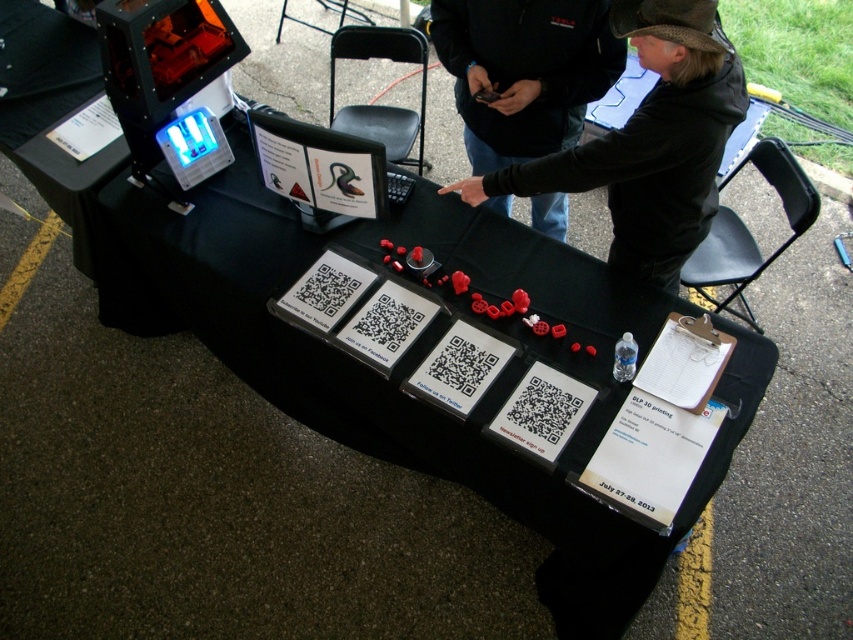
Is point (670, 163) in front of point (485, 51)?

That is True.

Is black leather jacket at upper center positioned before black leather jacket at center?

Yes.

Between point (692, 0) and point (560, 227), which one is positioned in front?

Point (692, 0) is more forward.

Identify the location of black leather jacket at upper center. This screenshot has width=853, height=640. (648, 141).